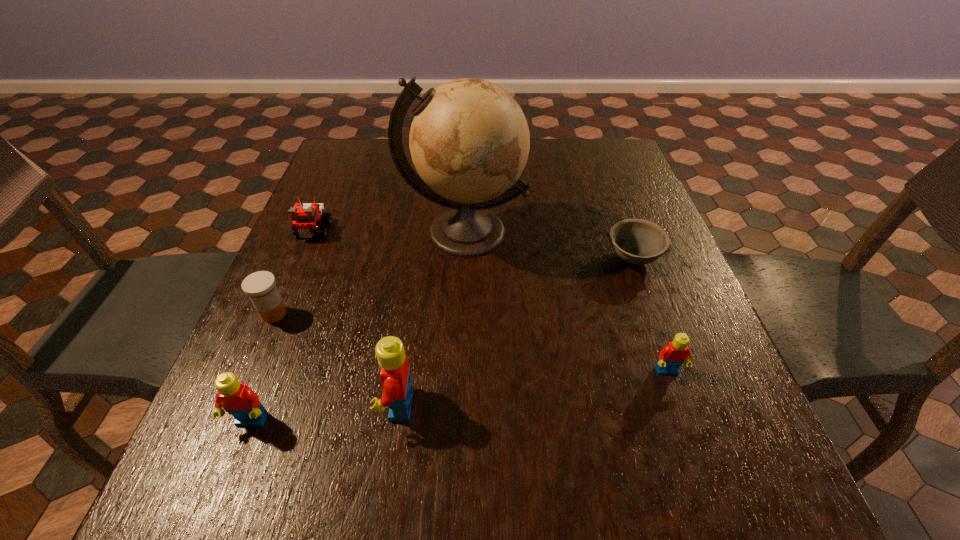
I want to click on vacant point located between the rightmost Lego and the bowl, so click(650, 315).

Find the location of a particular element. vacant point located between the bowl and the rightmost Lego is located at coordinates (650, 315).

Locate an element on the screen. The height and width of the screenshot is (540, 960). vacant space in between the tallest Lego and the third shortest Lego is located at coordinates (324, 413).

The image size is (960, 540). I want to click on vacant space that is in between the tallest Lego and the farthest Lego, so click(355, 318).

Find the location of a particular element. Image resolution: width=960 pixels, height=540 pixels. free space between the tallest object and the farthest Lego is located at coordinates (389, 231).

Image resolution: width=960 pixels, height=540 pixels. Identify the location of free spot between the globe and the bowl. (548, 245).

The image size is (960, 540). What are the coordinates of `object that stands as the sixth closest to the medicine` in the screenshot? It's located at (671, 357).

The image size is (960, 540). What are the coordinates of `object that is the sixth closest to the rightmost Lego` in the screenshot? It's located at (306, 217).

You are a GUI agent. You are given a task and a screenshot of the screen. Output one action in this format:
    pyautogui.click(x=<x>, y=<y>)
    Task: Click on the Lego that stands as the third closest to the farthest Lego
    This screenshot has height=540, width=960.
    Given the screenshot: What is the action you would take?
    pyautogui.click(x=671, y=357)

Identify which Lego is the closest to the sixth shortest object. Please provide its 2D coordinates. Your answer should be formatted as a tuple, i.e. [(x, y)], where the tuple contains the x and y coordinates of a point satisfying the conditions above.

[(237, 399)]